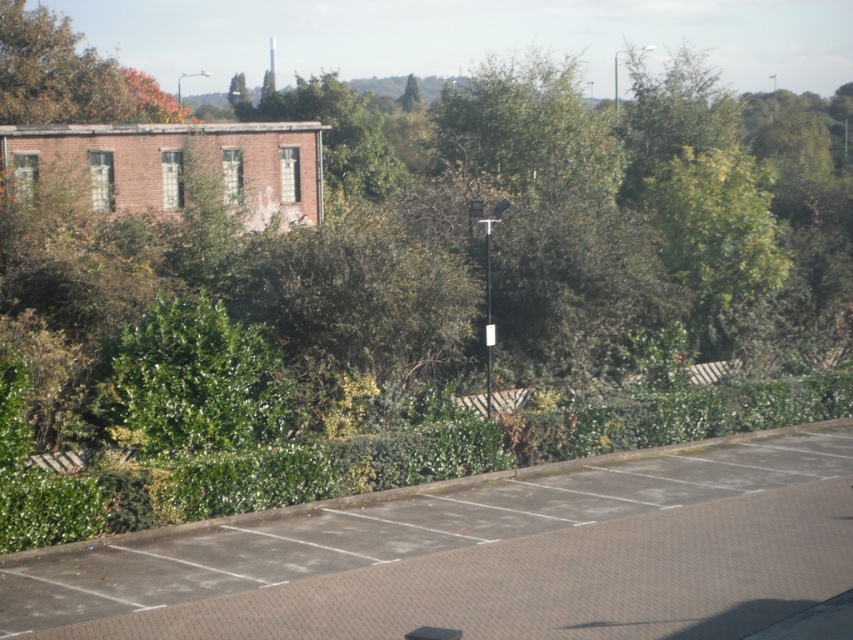
Between brown textured pavement at lower center and metallic pole at center, which one has more height?

Standing taller between the two is brown textured pavement at lower center.

Identify the location of brown textured pavement at lower center. (483, 556).

Does brown textured pavement at lower center have a lesser width compared to green leafy tree at upper center?

No.

Does brown textured pavement at lower center appear on the right side of green leafy tree at upper center?

Correct, you'll find brown textured pavement at lower center to the right of green leafy tree at upper center.

Describe the element at coordinates (483, 556) in the screenshot. I see `brown textured pavement at lower center` at that location.

You are a GUI agent. You are given a task and a screenshot of the screen. Output one action in this format:
    pyautogui.click(x=<x>, y=<y>)
    Task: Click on the brown textured pavement at lower center
    The image size is (853, 640).
    Given the screenshot: What is the action you would take?
    pyautogui.click(x=483, y=556)

Does metallic pole at center have a smaller size compared to green leafy tree at upper center?

Yes.

Where is `metallic pole at center`? metallic pole at center is located at coordinates (486, 282).